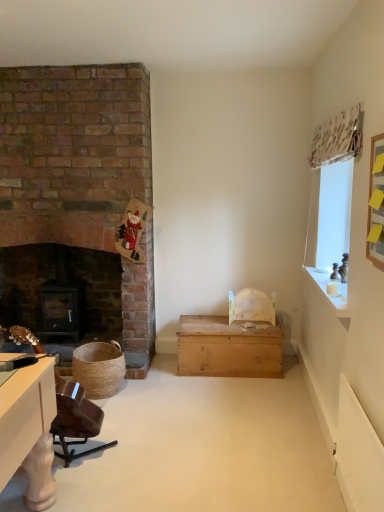
Describe the element at coordinates (61, 292) in the screenshot. The width and height of the screenshot is (384, 512). I see `dark wood fireplace at left` at that location.

Locate an element on the screen. The height and width of the screenshot is (512, 384). brown wood swivel chair at lower left is located at coordinates (75, 419).

Looking at this image, from their relative heights in the image, would you say brown wood swivel chair at lower left is taller or shorter than dark wood fireplace at left?

Considering their sizes, brown wood swivel chair at lower left has less height than dark wood fireplace at left.

Considering the relative sizes of brown wood swivel chair at lower left and dark wood fireplace at left in the image provided, is brown wood swivel chair at lower left bigger than dark wood fireplace at left?

No, brown wood swivel chair at lower left is not bigger than dark wood fireplace at left.

Considering the relative sizes of brown wood swivel chair at lower left and dark wood fireplace at left in the image provided, is brown wood swivel chair at lower left thinner than dark wood fireplace at left?

No.

Between white wood candle at upper right and dark wood fireplace at left, which one appears on the left side from the viewer's perspective?

dark wood fireplace at left.

Is white wood candle at upper right thinner than dark wood fireplace at left?

Yes.

Where is `window sill on the right side of dark wood fireplace at left`? The height and width of the screenshot is (512, 384). window sill on the right side of dark wood fireplace at left is located at coordinates click(331, 295).

Which is closer to the camera, (341, 313) or (32, 312)?

The point (341, 313) is more forward.

Between dark wood fireplace at left and white wood candle at upper right, which one has more height?

dark wood fireplace at left is taller.

Would you say dark wood fireplace at left is inside or outside white wood candle at upper right?

dark wood fireplace at left is not inside white wood candle at upper right, it's outside.

In the image, is dark wood fireplace at left positioned in front of or behind white wood candle at upper right?

Clearly, dark wood fireplace at left is behind white wood candle at upper right.

Is point (17, 300) closer to camera compared to point (325, 280)?

No, it is not.

In order to click on swivel chair on the left side of white wood candle at upper right in this screenshot , I will do `click(75, 419)`.

Are white wood candle at upper right and brown wood swivel chair at lower left far apart?

white wood candle at upper right is positioned a significant distance from brown wood swivel chair at lower left.

Considering the sizes of objects white wood candle at upper right and brown wood swivel chair at lower left in the image provided, who is thinner, white wood candle at upper right or brown wood swivel chair at lower left?

white wood candle at upper right.

Looking at this image, does white wood candle at upper right have a smaller size compared to brown wood swivel chair at lower left?

Correct, white wood candle at upper right occupies less space than brown wood swivel chair at lower left.

Considering the relative positions of wooden chest at center and dark wood fireplace at left in the image provided, is wooden chest at center to the right of dark wood fireplace at left from the viewer's perspective?

Yes, wooden chest at center is to the right of dark wood fireplace at left.

Does wooden chest at center have a greater width compared to dark wood fireplace at left?

Yes, wooden chest at center is wider than dark wood fireplace at left.

Does wooden chest at center have a greater height compared to dark wood fireplace at left?

In fact, wooden chest at center may be shorter than dark wood fireplace at left.

Find the location of a particular element. This screenshot has height=512, width=384. fireplace above the wooden chest at center (from the image's perspective) is located at coordinates tap(61, 292).

Is white wood candle at upper right to the left or to the right of wooden chest at center in the image?

From the image, it's evident that white wood candle at upper right is to the right of wooden chest at center.

From the picture: Considering the sizes of white wood candle at upper right and wooden chest at center in the image, is white wood candle at upper right bigger or smaller than wooden chest at center?

Considering their sizes, white wood candle at upper right takes up less space than wooden chest at center.

From a real-world perspective, is white wood candle at upper right under wooden chest at center?

Incorrect, from a real-world perspective, white wood candle at upper right is higher than wooden chest at center.

Does brown wood swivel chair at lower left have a larger size compared to white wood candle at upper right?

Yes, brown wood swivel chair at lower left is bigger than white wood candle at upper right.

Is the position of brown wood swivel chair at lower left more distant than that of white wood candle at upper right?

That is False.

How many degrees apart are the facing directions of brown wood swivel chair at lower left and white wood candle at upper right?

91.1 degrees.

How much distance is there between brown wood swivel chair at lower left and white wood candle at upper right?

brown wood swivel chair at lower left is 1.63 meters from white wood candle at upper right.

I want to click on fireplace behind the brown wood swivel chair at lower left, so click(x=61, y=292).

The height and width of the screenshot is (512, 384). I want to click on window sill on the right of dark wood fireplace at left, so click(331, 295).

Considering their positions, is brown wood swivel chair at lower left positioned further to wooden chest at center than dark wood fireplace at left?

Among the two, brown wood swivel chair at lower left is located further to wooden chest at center.

Estimate the real-world distances between objects in this image. Which object is further from wooden chest at center, brown wood swivel chair at lower left or white wood candle at upper right?

brown wood swivel chair at lower left lies further to wooden chest at center than the other object.

Looking at the image, which one is located closer to white wood candle at upper right, brown wood swivel chair at lower left or dark wood fireplace at left?

Based on the image, brown wood swivel chair at lower left appears to be nearer to white wood candle at upper right.

Which object lies nearer to the anchor point dark wood fireplace at left, wooden chest at center or brown wood swivel chair at lower left?

The object closer to dark wood fireplace at left is wooden chest at center.

Which object lies further to the anchor point white wood candle at upper right, dark wood fireplace at left or wooden chest at center?

dark wood fireplace at left lies further to white wood candle at upper right than the other object.

Estimate the real-world distances between objects in this image. Which object is closer to white wood candle at upper right, dark wood fireplace at left or brown wood swivel chair at lower left?

brown wood swivel chair at lower left is closer to white wood candle at upper right.

Considering their positions, is white wood candle at upper right positioned further to brown wood swivel chair at lower left than wooden chest at center?

white wood candle at upper right.

Estimate the real-world distances between objects in this image. Which object is further from wooden chest at center, white wood candle at upper right or dark wood fireplace at left?

dark wood fireplace at left lies further to wooden chest at center than the other object.

Image resolution: width=384 pixels, height=512 pixels. Find the location of `box situated between dark wood fireplace at left and white wood candle at upper right from left to right`. box situated between dark wood fireplace at left and white wood candle at upper right from left to right is located at coordinates (228, 347).

Where is `swivel chair between dark wood fireplace at left and white wood candle at upper right in the horizontal direction`? This screenshot has width=384, height=512. swivel chair between dark wood fireplace at left and white wood candle at upper right in the horizontal direction is located at coordinates (75, 419).

You are a GUI agent. You are given a task and a screenshot of the screen. Output one action in this format:
    pyautogui.click(x=<x>, y=<y>)
    Task: Click on the box located between brown wood swivel chair at lower left and dark wood fireplace at left in the depth direction
    This screenshot has width=384, height=512.
    Given the screenshot: What is the action you would take?
    pyautogui.click(x=228, y=347)

Locate an element on the screen. This screenshot has height=512, width=384. box located between brown wood swivel chair at lower left and white wood candle at upper right in the left-right direction is located at coordinates (228, 347).